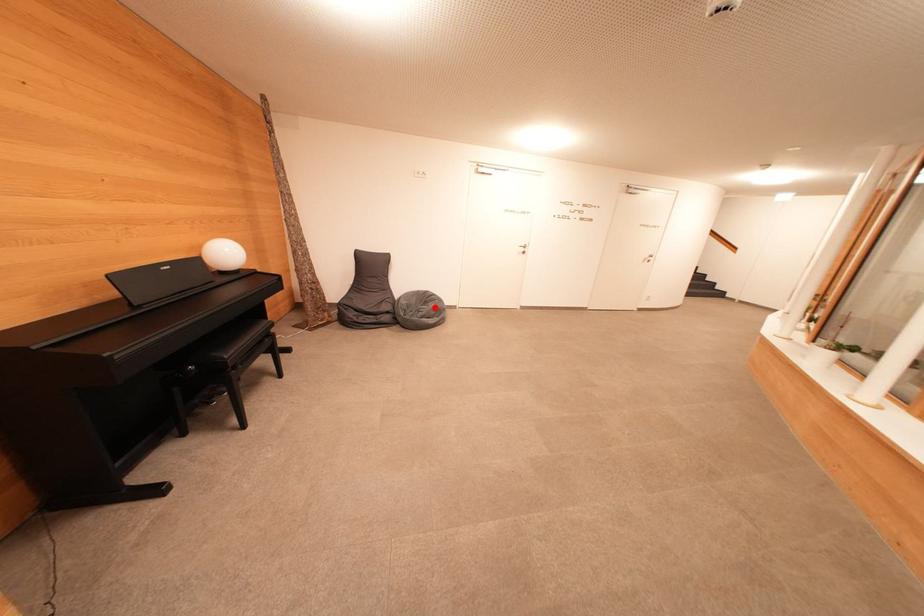
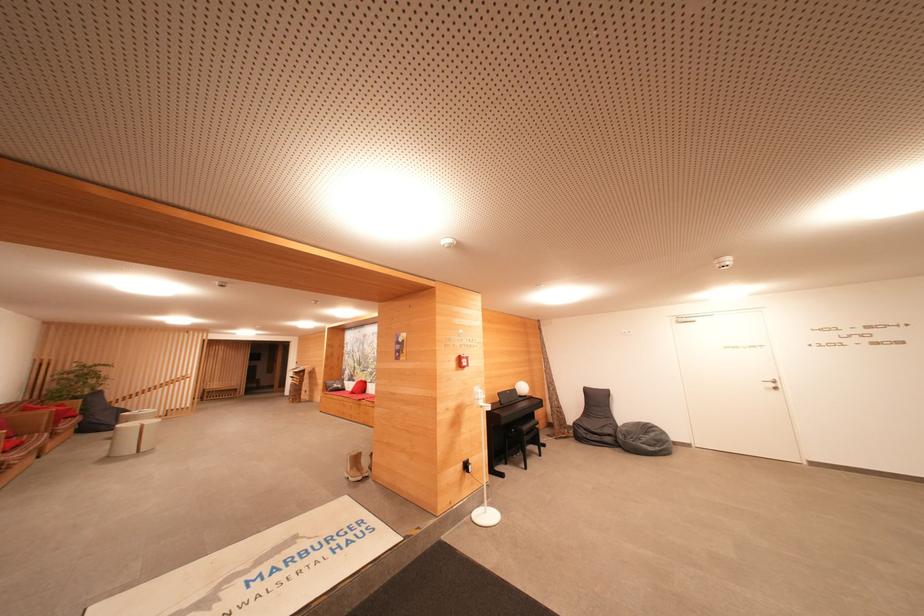
Question: A red point is marked in image1. In image2, is the corresponding 3D point closer to the camera or farther? Reply with the corresponding letter.

Choices:
 (A) The corresponding 3D point is closer.
 (B) The corresponding 3D point is farther.

Answer: (B)